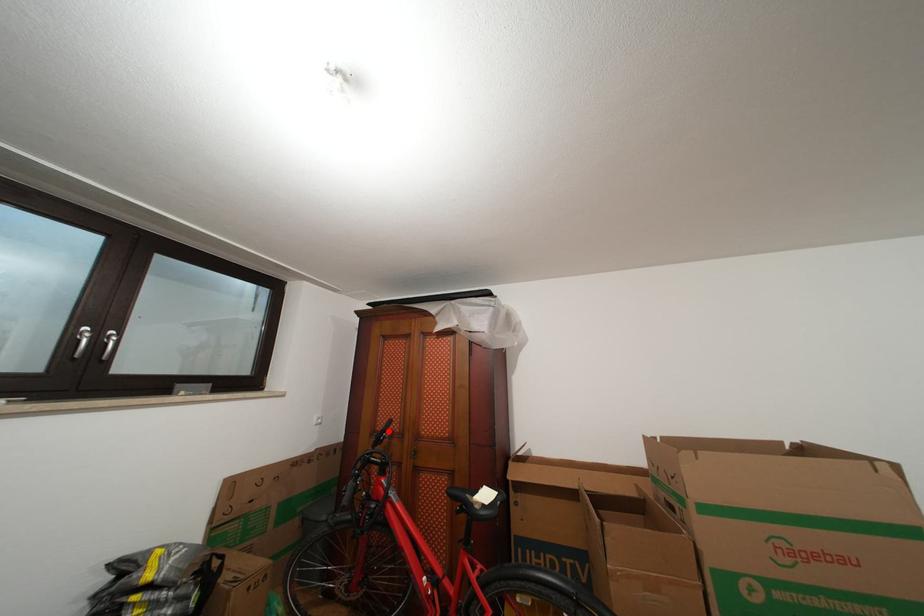
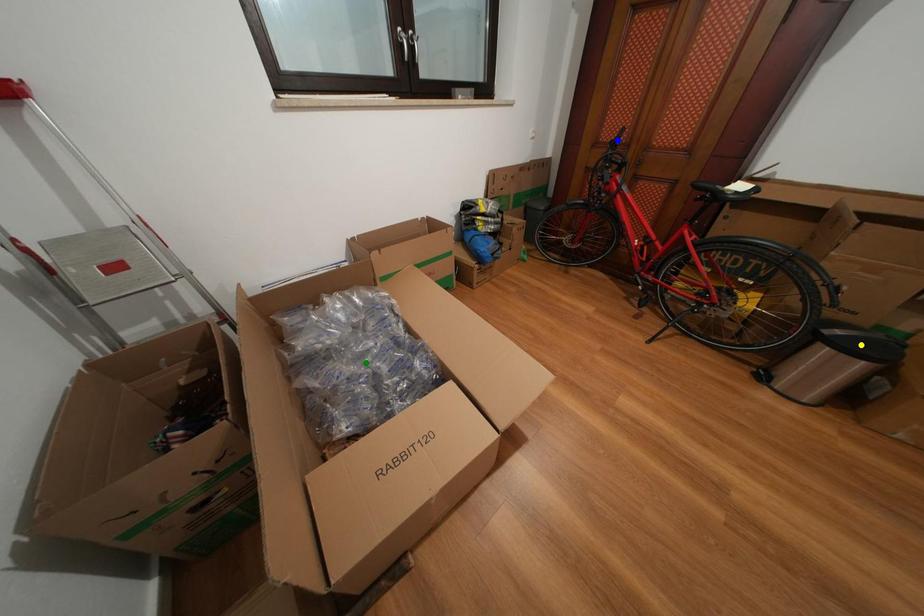
Question: I am providing you with two images of the same scene from different viewpoints. A red point is marked on the first image. You are given multiple points on the second image. Which point in image 2 is actually the same real-world point as the red point in image 1?

Choices:
 (A) green point
 (B) yellow point
 (C) blue point

Answer: (C)